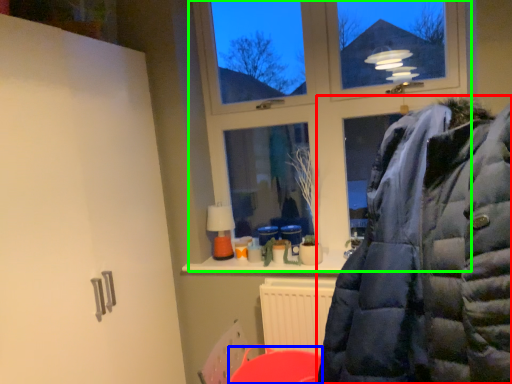
Question: Considering the real-world distances, which object is farthest from jacket (highlighted by a red box)? table (highlighted by a blue box) or window (highlighted by a green box)?

Choices:
 (A) table
 (B) window

Answer: (B)